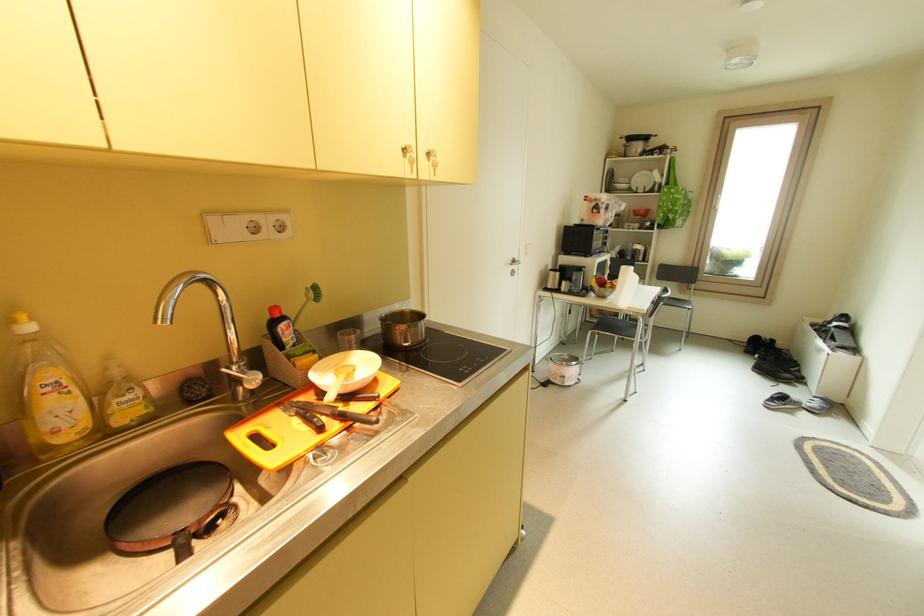
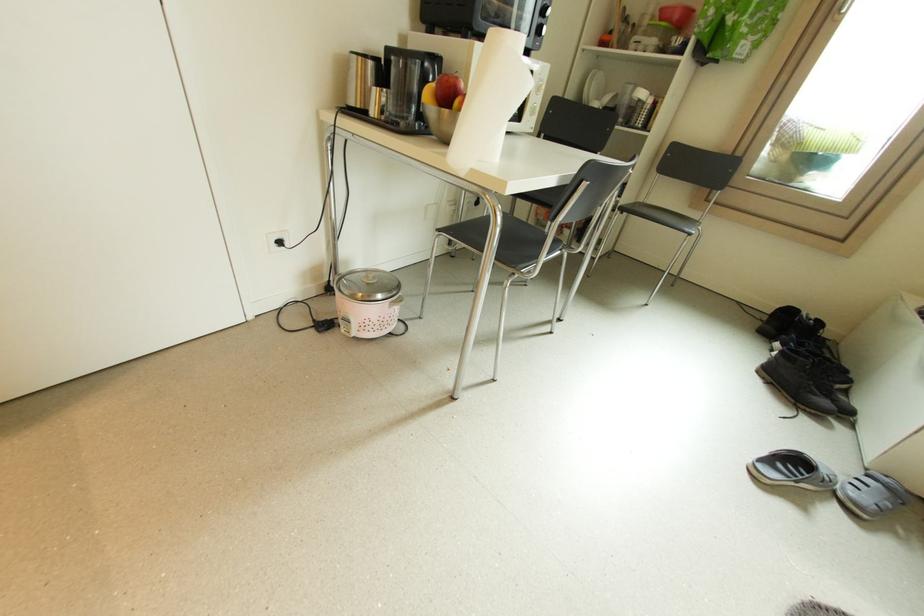
Where in the second image is the point corresponding to point (639, 211) from the first image?

(666, 10)